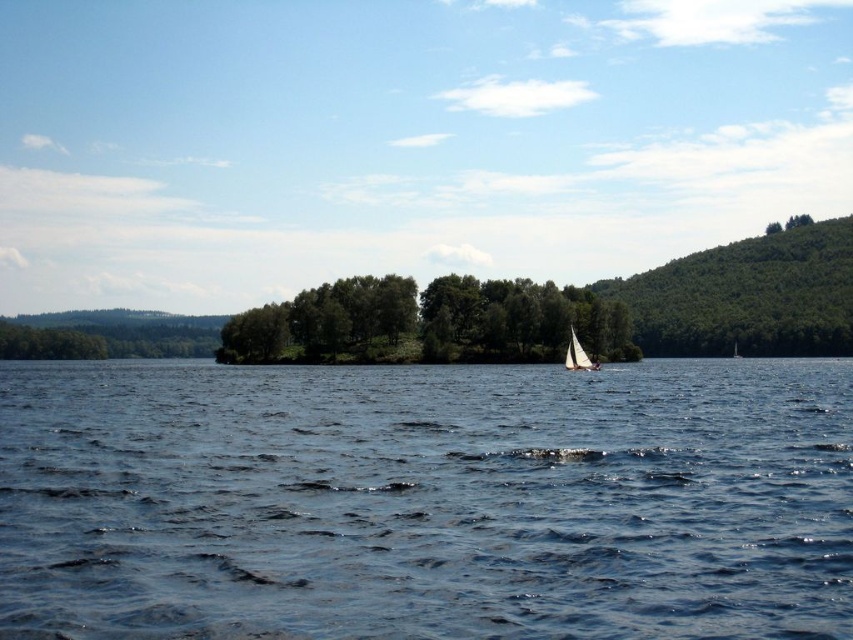
Does blue water at center have a smaller size compared to green leafy trees at center?

Yes.

Image resolution: width=853 pixels, height=640 pixels. What do you see at coordinates (425, 500) in the screenshot? I see `blue water at center` at bounding box center [425, 500].

Locate an element on the screen. This screenshot has width=853, height=640. blue water at center is located at coordinates (425, 500).

Can you confirm if blue water at center is shorter than white sailboat at center?

Yes, blue water at center is shorter than white sailboat at center.

Who is more distant from viewer, (x=548, y=524) or (x=572, y=328)?

Positioned behind is point (x=572, y=328).

Where is `blue water at center`? This screenshot has width=853, height=640. blue water at center is located at coordinates (425, 500).

You are a GUI agent. You are given a task and a screenshot of the screen. Output one action in this format:
    pyautogui.click(x=<x>, y=<y>)
    Task: Click on the blue water at center
    This screenshot has width=853, height=640.
    Given the screenshot: What is the action you would take?
    pyautogui.click(x=425, y=500)

Does green leafy trees at center have a lesser height compared to white sailboat at center?

No, green leafy trees at center is not shorter than white sailboat at center.

You are a GUI agent. You are given a task and a screenshot of the screen. Output one action in this format:
    pyautogui.click(x=<x>, y=<y>)
    Task: Click on the green leafy trees at center
    
    Given the screenshot: What is the action you would take?
    pyautogui.click(x=428, y=323)

Is point (502, 305) positioned behind point (573, 348)?

That is True.

This screenshot has width=853, height=640. In order to click on green leafy trees at center in this screenshot , I will do `click(428, 323)`.